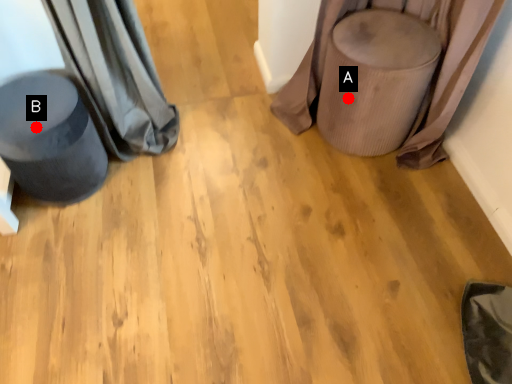
Question: Two points are circled on the image, labeled by A and B beside each circle. Among these points, which one is farthest from the camera?

Choices:
 (A) A is further
 (B) B is further

Answer: (A)